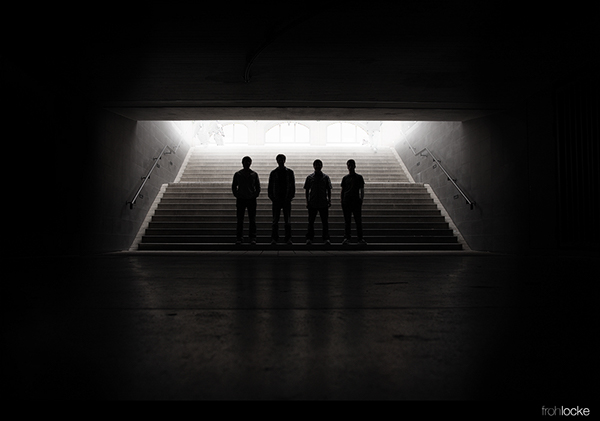
Where is `hand rail`? hand rail is located at coordinates (154, 160), (446, 175), (410, 145), (182, 142).